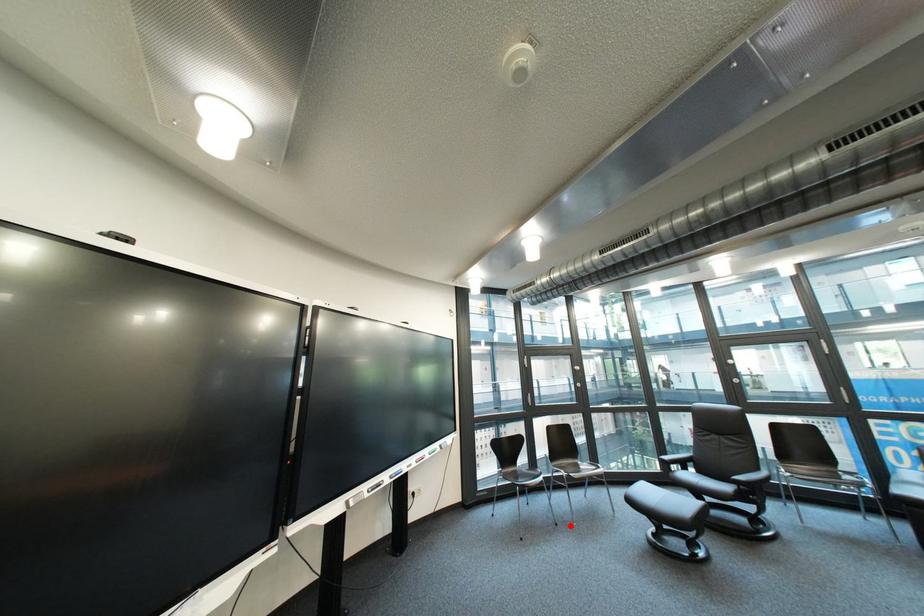
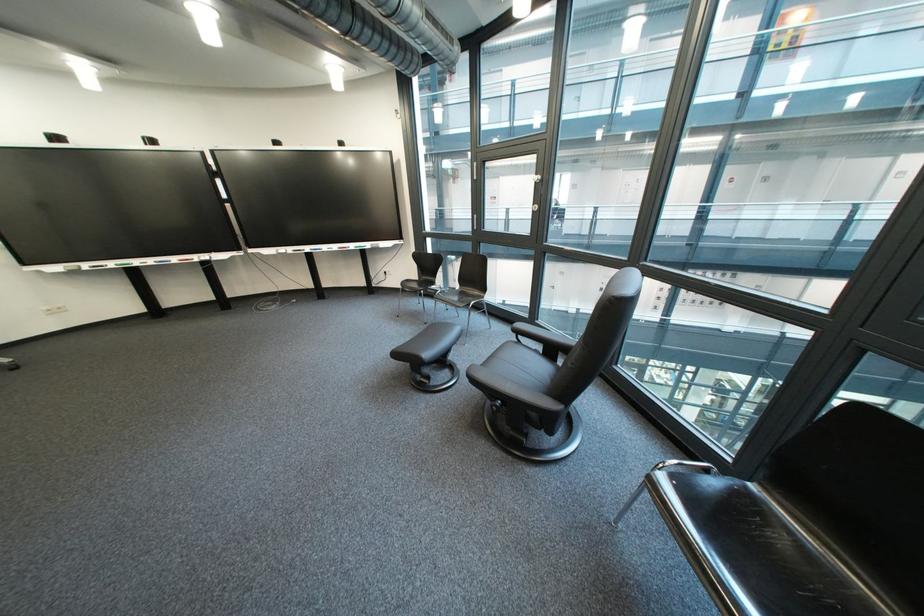
Locate, in the second image, the point that corresponds to the highlighted location in the first image.

(439, 325)